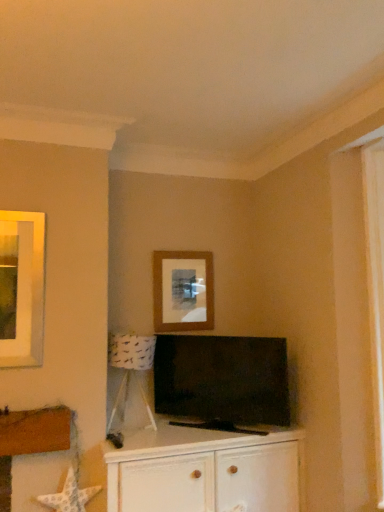
The width and height of the screenshot is (384, 512). I want to click on vacant space to the right of white paper lampshade at lower left, so click(x=188, y=435).